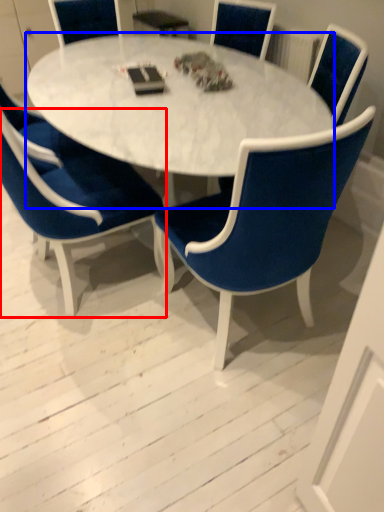
Question: Which of the following is the farthest to the observer, chair (highlighted by a red box) or coffee table (highlighted by a blue box)?

Choices:
 (A) chair
 (B) coffee table

Answer: (B)